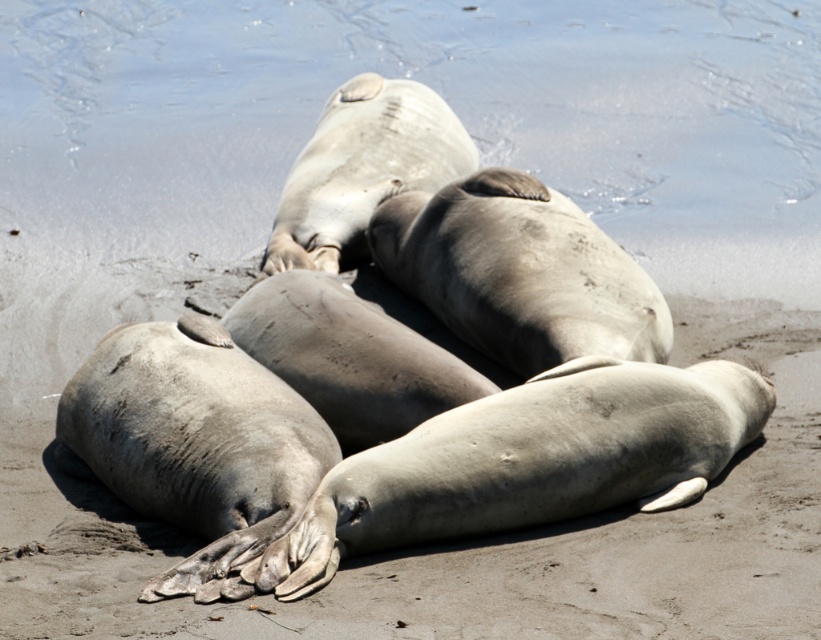
Question: Which point appears closest to the camera in this image?

Choices:
 (A) (0, 58)
 (B) (668, 296)

Answer: (B)

Question: Does clear water at upper center have a larger size compared to gray sandy beach at center?

Choices:
 (A) yes
 (B) no

Answer: (B)

Question: Is clear water at upper center wider than gray sandy beach at center?

Choices:
 (A) yes
 (B) no

Answer: (B)

Question: Can you confirm if clear water at upper center is bigger than gray sandy beach at center?

Choices:
 (A) yes
 (B) no

Answer: (B)

Question: Which object is farther from the camera taking this photo?

Choices:
 (A) clear water at upper center
 (B) gray sandy beach at center

Answer: (A)

Question: Which object appears farthest from the camera in this image?

Choices:
 (A) gray sandy beach at center
 (B) clear water at upper center

Answer: (B)